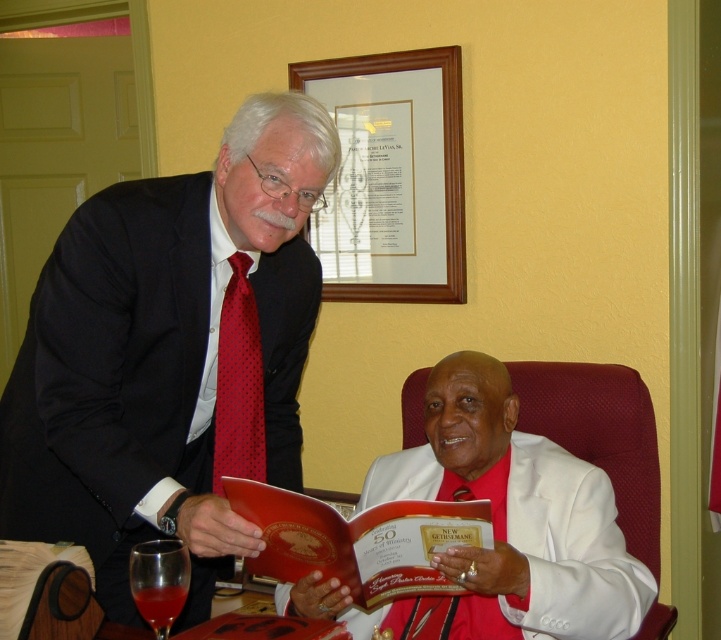
From the picture: Can you confirm if white satin suit at center is shorter than matte red book at center?

No.

Is white satin suit at center further to the viewer compared to matte red book at center?

Yes, white satin suit at center is behind matte red book at center.

Does point (441, 365) come behind point (366, 556)?

Yes, point (441, 365) is farther from viewer.

What are the coordinates of `white satin suit at center` in the screenshot? It's located at (499, 525).

Is white satin suit at center to the right of translucent glass at lower left from the viewer's perspective?

Yes, white satin suit at center is to the right of translucent glass at lower left.

The image size is (721, 640). In order to click on white satin suit at center in this screenshot , I will do `click(499, 525)`.

Measure the distance between matte black suit at left and camera.

matte black suit at left is 4.12 feet away from camera.

This screenshot has width=721, height=640. In order to click on matte black suit at left in this screenshot , I will do [x=169, y=355].